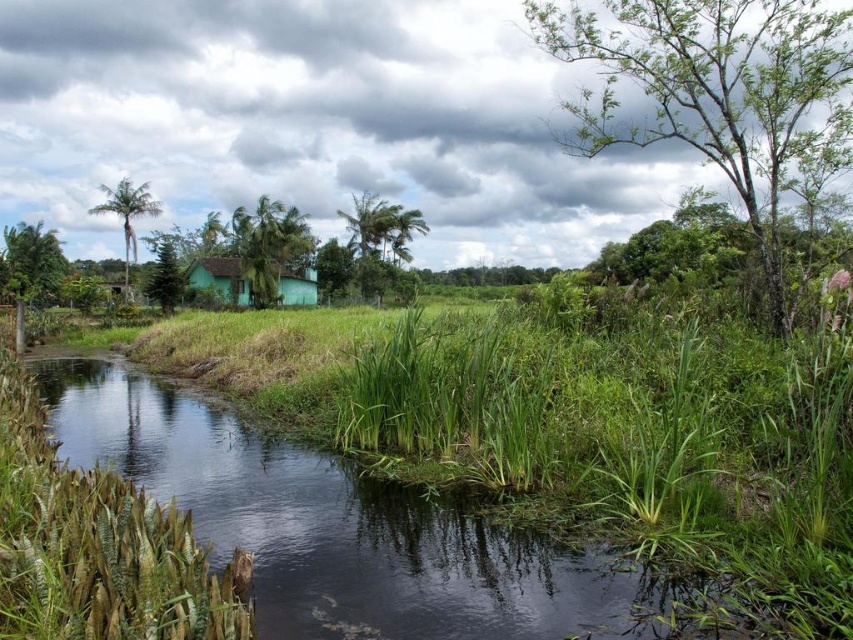
Which is below, green leafy palm tree at center or green leafy tree at left?

Positioned lower is green leafy tree at left.

Which is above, green leafy palm tree at center or green leafy tree at left?

green leafy palm tree at center is above.

Between point (364, 204) and point (9, 269), which one is positioned in front?

Positioned in front is point (9, 269).

Where is `green leafy palm tree at center`? Image resolution: width=853 pixels, height=640 pixels. green leafy palm tree at center is located at coordinates (380, 237).

Can you confirm if green matte house at center is positioned to the right of green matte tree at center-left?

Indeed, green matte house at center is positioned on the right side of green matte tree at center-left.

Does green matte house at center have a larger size compared to green matte tree at center-left?

No, green matte house at center is not bigger than green matte tree at center-left.

Find the location of a particular element. Image resolution: width=853 pixels, height=640 pixels. green matte house at center is located at coordinates (219, 280).

Looking at this image, is green leafy tree at left to the left of green leafy palm tree at upper left from the viewer's perspective?

Correct, you'll find green leafy tree at left to the left of green leafy palm tree at upper left.

Can you confirm if green leafy tree at left is taller than green leafy palm tree at upper left?

Incorrect, green leafy tree at left's height is not larger of green leafy palm tree at upper left's.

Which is in front, point (25, 294) or point (149, 193)?

Point (25, 294)

Where is `green leafy tree at left`? This screenshot has width=853, height=640. green leafy tree at left is located at coordinates (32, 262).